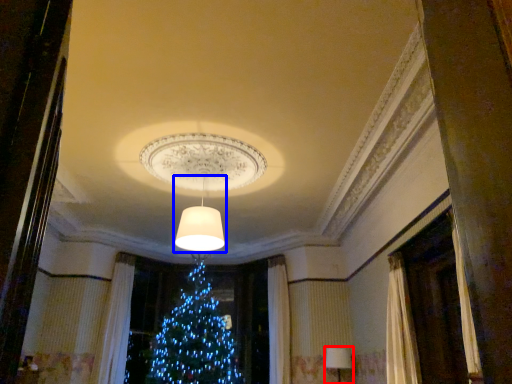
Question: Which object is further to the camera taking this photo, lamp (highlighted by a red box) or lamp (highlighted by a blue box)?

Choices:
 (A) lamp
 (B) lamp

Answer: (A)